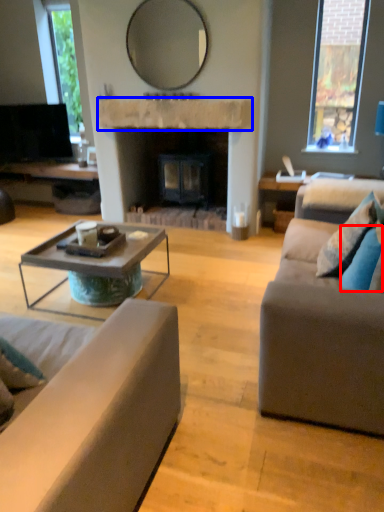
Question: Which of the following is the closest to the observer, pillow (highlighted by a red box) or mantle (highlighted by a blue box)?

Choices:
 (A) pillow
 (B) mantle

Answer: (A)